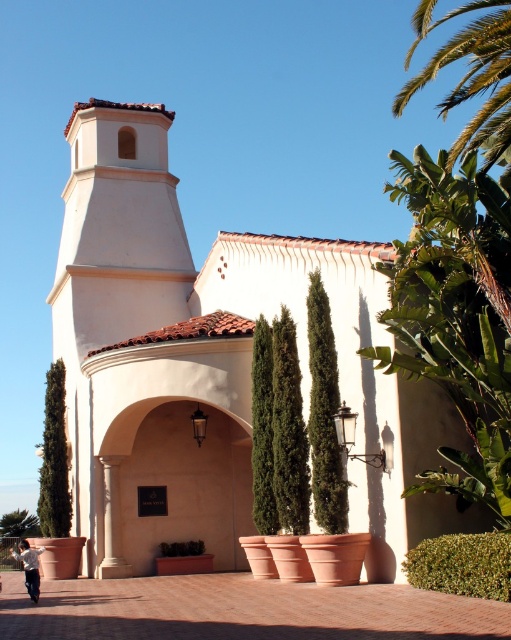
You are standing in front of the Mediterranean building and want to walk from the point at coordinates point (61, 508) to the point at coordinates point (171, 547). Which direction should you move to reach your destination?

To move from point (61, 508) to point (171, 547), you should move forward since point (61, 508) is behind point (171, 547).

From the picture: You are a window cleaner with a ladder that can reach up to 10 meters. You need to clean both the white stucco church at center and the green textured bush at left. Based on their heights, which one will require the ladder to be fully extended?

The white stucco church at center is much taller than the green textured bush at left, so the ladder will need to be fully extended to clean the white stucco church at center.